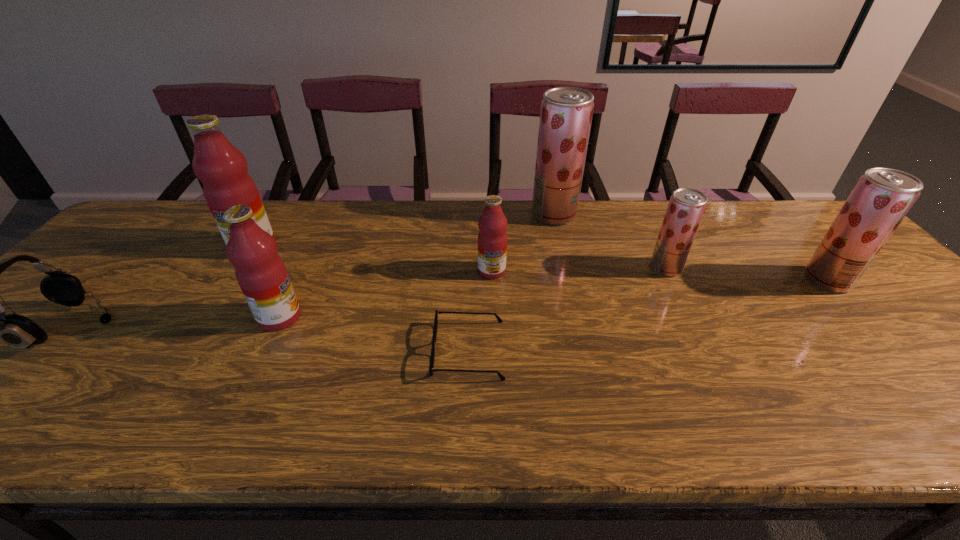
Find the location of `free space that satisfies the following two spatial constraints: 1. on the front side of the second object from right to left; 2. on the right side of the rightmost strawberry fruit juice`. free space that satisfies the following two spatial constraints: 1. on the front side of the second object from right to left; 2. on the right side of the rightmost strawberry fruit juice is located at coordinates (672, 280).

This screenshot has width=960, height=540. Identify the location of free location that satisfies the following two spatial constraints: 1. on the front-facing side of the shortest object; 2. on the label of the seventh object from right to left. [x=471, y=246].

Identify the location of vacant area in the image that satisfies the following two spatial constraints: 1. on the front-facing side of the smallest strawberry fruit juice; 2. on the right side of the spectacles. The height and width of the screenshot is (540, 960). (470, 268).

Image resolution: width=960 pixels, height=540 pixels. Find the location of `free space that satisfies the following two spatial constraints: 1. on the front-facing side of the spectacles; 2. on the label of the second fruit juice from left to right`. free space that satisfies the following two spatial constraints: 1. on the front-facing side of the spectacles; 2. on the label of the second fruit juice from left to right is located at coordinates 469,317.

I want to click on free space that satisfies the following two spatial constraints: 1. with the microphone on the side of the leftmost object; 2. on the front-facing side of the shortest object, so click(53, 350).

Identify the location of vacant region that satisfies the following two spatial constraints: 1. on the label of the rightmost pink fruit juice; 2. with the microphone on the side of the headset. (493, 327).

Where is `vacant region that satisfies the following two spatial constraints: 1. on the label of the biggest pink fruit juice; 2. on the right side of the second biggest strawberry fruit juice`? vacant region that satisfies the following two spatial constraints: 1. on the label of the biggest pink fruit juice; 2. on the right side of the second biggest strawberry fruit juice is located at coordinates (231, 280).